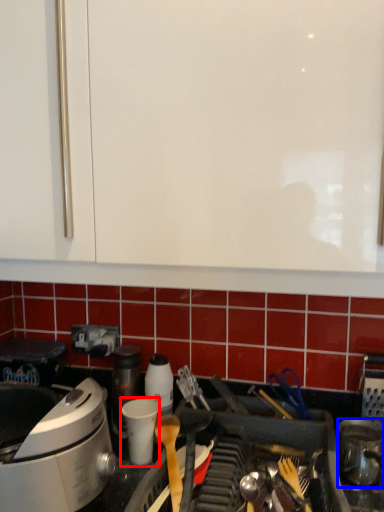
Question: Which of the following is the farthest to the observer, appliance (highlighted by a red box) or kitchen appliance (highlighted by a blue box)?

Choices:
 (A) appliance
 (B) kitchen appliance

Answer: (A)